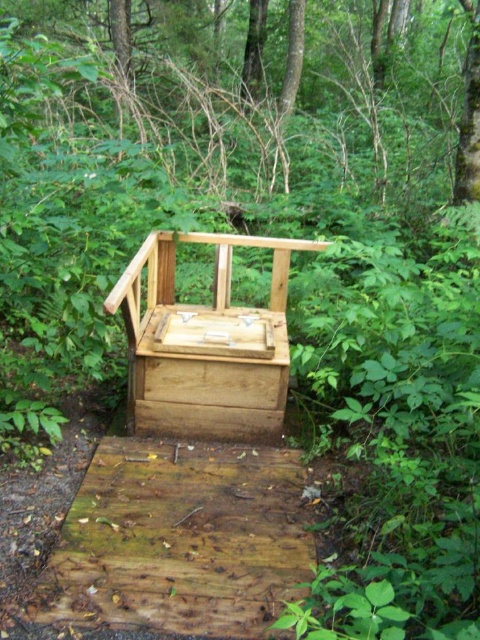
You are a park ranger checking the composting toilet area. You notice the brown wood tree at upper center and the natural wood chair at center. Which object is wider?

The natural wood chair at center is wider than the brown wood tree at upper center.

You are planning to install a new composting toilet in the forest area shown. The brown wood tree at upper center and the natural wood chair at center are in the way. Which object should you move to make space for the toilet installation?

The brown wood tree at upper center should be moved because it is shorter than the natural wood chair at center, so moving the shorter tree would be easier to accommodate the toilet installation.